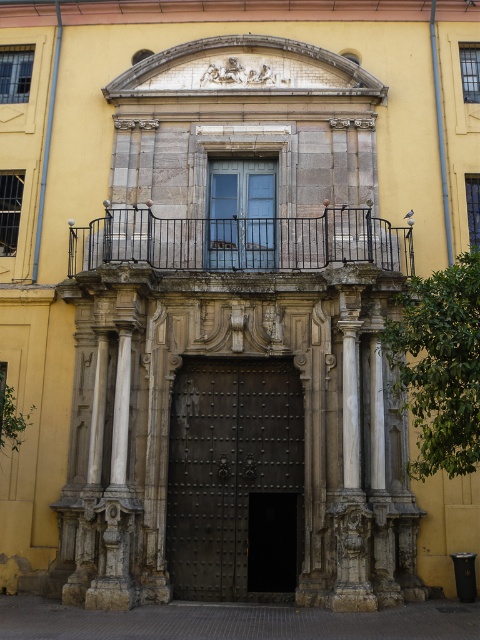
Does dark brown metal gate at center lie behind matte glass door at center?

No, it is in front of matte glass door at center.

Describe the element at coordinates (235, 480) in the screenshot. I see `dark brown metal gate at center` at that location.

Between point (192, 368) and point (275, 260), which one is positioned in front?

Positioned in front is point (192, 368).

Where is `dark brown metal gate at center`? dark brown metal gate at center is located at coordinates (235, 480).

Is dark brown metal gate at center wider than black wrought iron balcony at upper center?

Incorrect, dark brown metal gate at center's width does not surpass black wrought iron balcony at upper center's.

Measure the distance between point (x=227, y=451) and camera.

They are 47.55 meters apart.

Is point (276, 570) closer to camera compared to point (305, 236)?

Yes, it is.

You are a GUI agent. You are given a task and a screenshot of the screen. Output one action in this format:
    pyautogui.click(x=<x>, y=<y>)
    Task: Click on the dark brown metal gate at center
    The height and width of the screenshot is (640, 480).
    Given the screenshot: What is the action you would take?
    pyautogui.click(x=235, y=480)

Based on the photo, between black wrought iron balcony at upper center and matte glass door at center, which one appears on the left side from the viewer's perspective?

black wrought iron balcony at upper center is more to the left.

Is black wrought iron balcony at upper center to the left of matte glass door at center from the viewer's perspective?

Indeed, black wrought iron balcony at upper center is positioned on the left side of matte glass door at center.

Find the location of `black wrought iron balcony at upper center`. black wrought iron balcony at upper center is located at coordinates (240, 241).